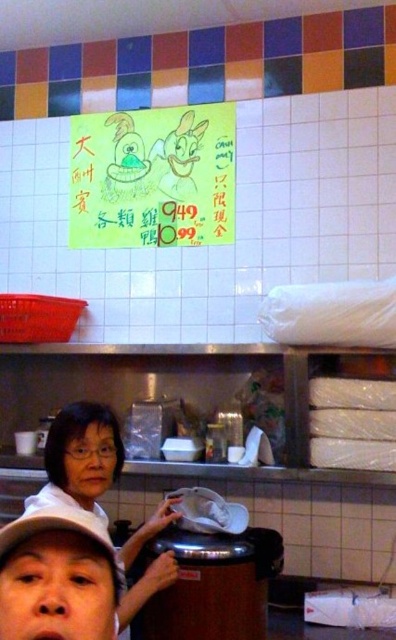
Question: Where is green paper sign at upper center located in relation to matte white shirt at center in the image?

Choices:
 (A) right
 (B) left

Answer: (A)

Question: Which point is closer to the camera?

Choices:
 (A) (127, 179)
 (B) (85, 472)

Answer: (B)

Question: Is green paper sign at upper center to the right of matte white shirt at center from the viewer's perspective?

Choices:
 (A) no
 (B) yes

Answer: (B)

Question: Considering the relative positions of green paper sign at upper center and matte white shirt at center in the image provided, where is green paper sign at upper center located with respect to matte white shirt at center?

Choices:
 (A) below
 (B) above

Answer: (B)